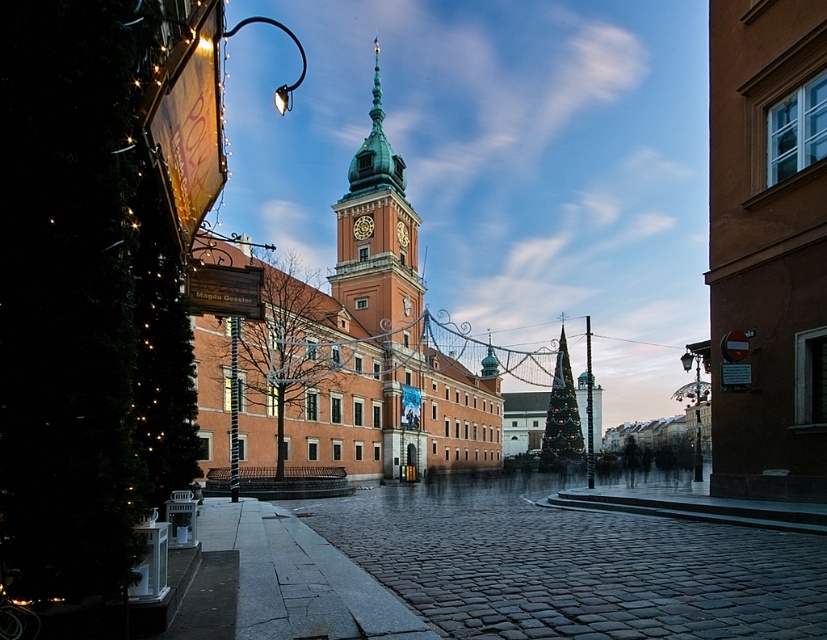
Does brick tower at center lie in front of green copper clock tower at center?

Yes, it is.

Is point (457, 460) farther from camera compared to point (416, 232)?

Yes, it is.

Where is `brick tower at center`? The height and width of the screenshot is (640, 827). brick tower at center is located at coordinates (364, 349).

At what (x,y) coordinates should I click in order to perform the action: click on brick tower at center. Please return your answer as a coordinate pair (x, y). Looking at the image, I should click on (364, 349).

Does point (379, 218) come farther from viewer compared to point (552, 440)?

No, it is in front of (552, 440).

Between point (359, 284) and point (558, 339), which one is positioned in front?

Positioned in front is point (359, 284).

Between point (338, 212) and point (548, 467), which one is positioned in front?

Positioned in front is point (338, 212).

I want to click on green copper clock tower at center, so click(378, 236).

Does green copper clock tower at center come behind gold metallic clock at center?

No.

Does green copper clock tower at center have a smaller size compared to gold metallic clock at center?

No, green copper clock tower at center is not smaller than gold metallic clock at center.

Find the location of a particular element. green copper clock tower at center is located at coordinates (378, 236).

I want to click on green copper clock tower at center, so click(x=378, y=236).